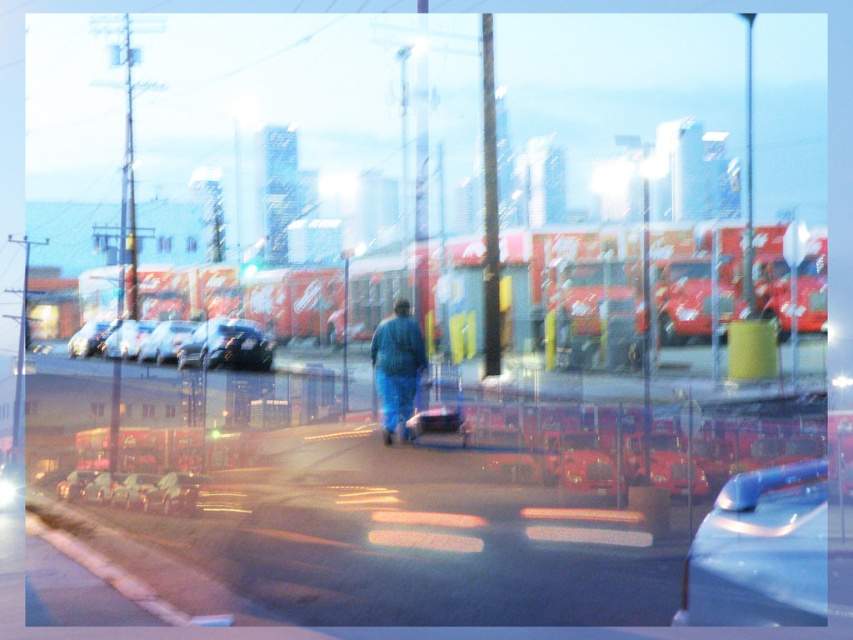
You are a delivery person standing at the shiny silver sedan at left and need to reach the shiny silver car at center. Which direction should you move to get there?

The shiny silver car at center is located below the shiny silver sedan at left, so you should move downward to reach it.

You are a delivery person needing to load a tall package onto a vehicle. You see a shiny black sedan at left and a metallic red truck at center. Which vehicle can accommodate the tall package based on their heights?

The shiny black sedan at left has a greater height compared to the metallic red truck at center, so the shiny black sedan at left can accommodate the tall package better.